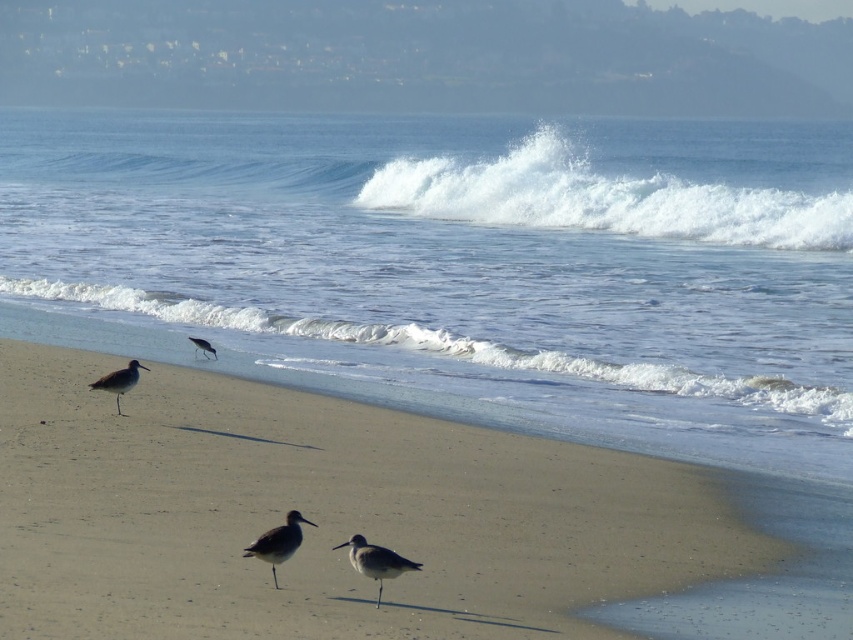
Which is above, white frothy wave at upper center or brown feathered bird at center?

white frothy wave at upper center

Can you confirm if white frothy wave at upper center is positioned below brown feathered bird at center?

No.

Where is `white frothy wave at upper center`? Image resolution: width=853 pixels, height=640 pixels. white frothy wave at upper center is located at coordinates [630, 180].

Is white foamy wave at lower center taller than brown feathered bird at center?

Indeed, white foamy wave at lower center has a greater height compared to brown feathered bird at center.

Does white foamy wave at lower center appear over brown feathered bird at center?

Indeed, white foamy wave at lower center is positioned over brown feathered bird at center.

Who is more forward, (x=80, y=301) or (x=247, y=547)?

Point (x=247, y=547) is more forward.

At what (x,y) coordinates should I click in order to perform the action: click on white foamy wave at lower center. Please return your answer as a coordinate pair (x, y). The width and height of the screenshot is (853, 640). Looking at the image, I should click on (451, 348).

Between white frothy wave at upper center and gray matte bird at left, which one has more height?

white frothy wave at upper center is taller.

Does white frothy wave at upper center have a larger size compared to gray matte bird at left?

Yes.

Is point (541, 125) positioned before point (206, 353)?

No, it is behind (206, 353).

Where is `white frothy wave at upper center`? white frothy wave at upper center is located at coordinates (630, 180).